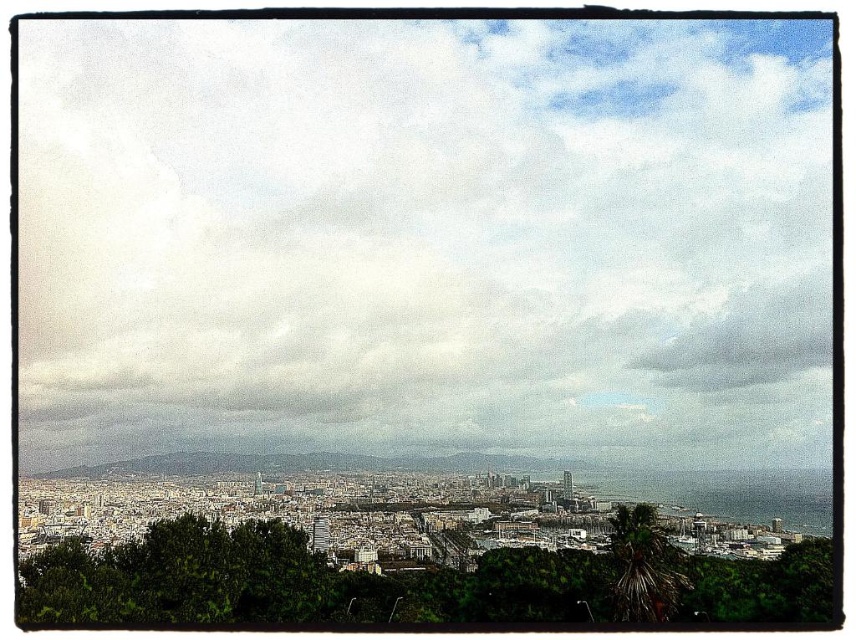
You are standing in the cityscape and want to take a photo of the cloudy sky at upper center and the green leafy palm at lower right. Which object will appear larger in the photo?

The cloudy sky at upper center will appear larger in the photo because it is closer to the viewer than the green leafy palm at lower right.

You are an urban planner reviewing this cityscape. You need to determine if the cloudy sky at upper center is positioned above the green leafy tree at center. Is this true?

Yes, the cloudy sky at upper center is located above the green leafy tree at center according to the description.